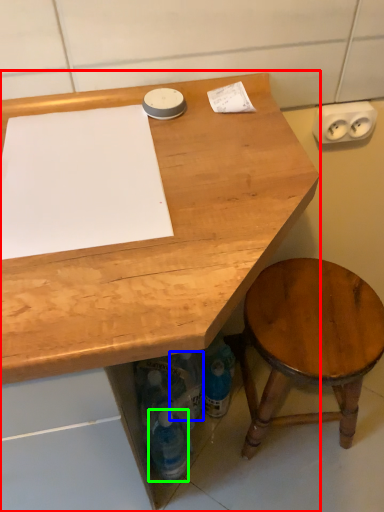
Question: Which object is the closest to the desk (highlighted by a red box)? Choose among these: bottle (highlighted by a blue box) or bottle (highlighted by a green box).

Choices:
 (A) bottle
 (B) bottle

Answer: (B)